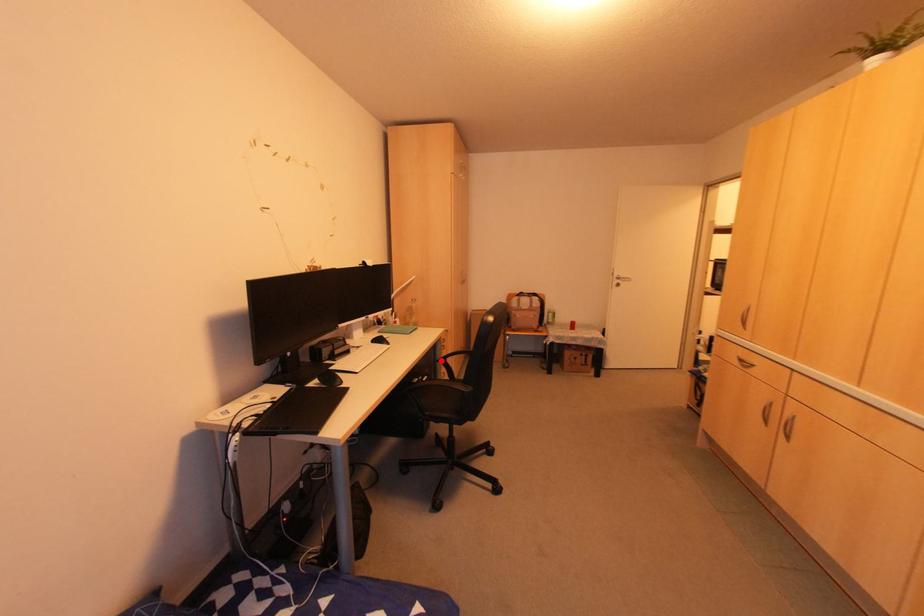
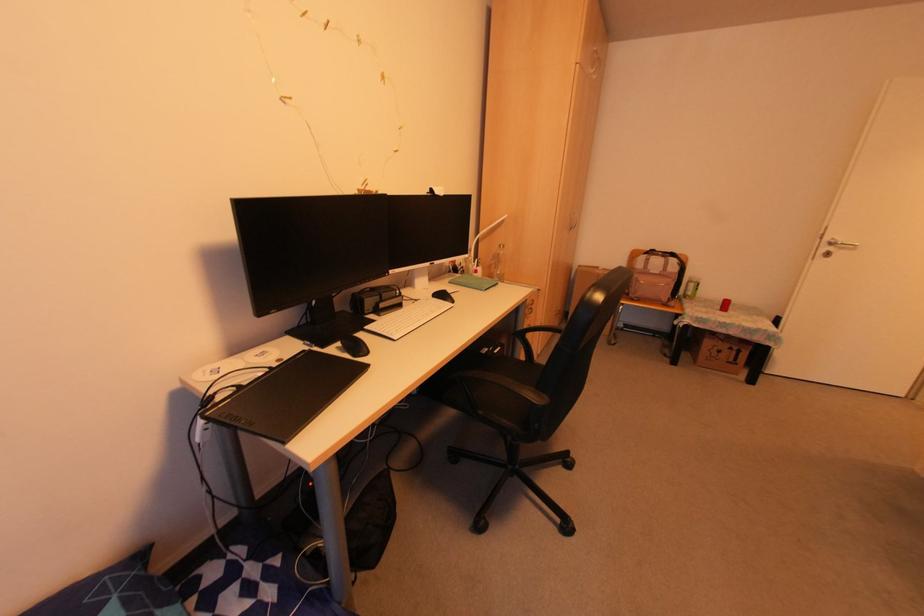
Find the pixel in the second image that matches the highlighted location in the first image.

(518, 334)